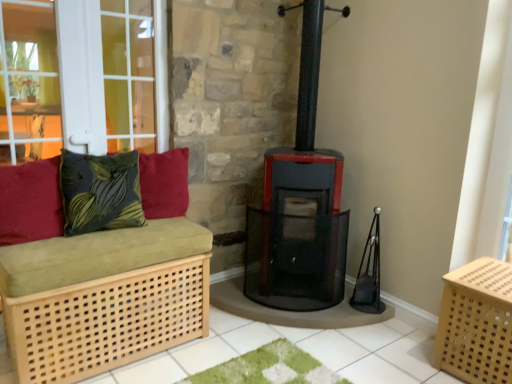
Describe the element at coordinates (100, 192) in the screenshot. I see `green leafy fabric cushion at left, the 2th pillow when ordered from right to left` at that location.

The width and height of the screenshot is (512, 384). Describe the element at coordinates (476, 323) in the screenshot. I see `light wood/canvassed crate at lower right` at that location.

The width and height of the screenshot is (512, 384). I want to click on velvety red cushion at left, placed as the 1th pillow when sorted from left to right, so click(x=30, y=202).

Locate an element on the screen. green leafy fabric cushion at left, positioned as the 2th pillow in left-to-right order is located at coordinates (100, 192).

Is velvety red cushion at left, placed as the 1th pillow when sorted from left to right, far from light wood/canvassed crate at lower right?

velvety red cushion at left, placed as the 1th pillow when sorted from left to right, is far away from light wood/canvassed crate at lower right.

Which is farther, (45, 200) or (458, 281)?

The point (45, 200) is farther from the camera.

From a real-world perspective, is velvety red cushion at left, which is the third pillow in right-to-left order, on light wood/canvassed crate at lower right?

Yes.

Is point (510, 278) positioned behind point (37, 208)?

That is True.

Looking at this image, from the image's perspective, who appears lower, light wood/canvassed crate at lower right or velvety red cushion at left, placed as the 1th pillow when sorted from left to right?

light wood/canvassed crate at lower right.

From a real-world perspective, between light wood/canvassed crate at lower right and velvety red cushion at left, which is the third pillow in right-to-left order, who is vertically lower?

light wood/canvassed crate at lower right is physically lower.

You are a GUI agent. You are given a task and a screenshot of the screen. Output one action in this format:
    pyautogui.click(x=<x>, y=<y>)
    Task: Click on the 1st pillow behind the light wood/canvassed crate at lower right, counting from the anchor's position
    The width and height of the screenshot is (512, 384).
    Given the screenshot: What is the action you would take?
    pyautogui.click(x=30, y=202)

In the scene shown: Considering the sizes of green leafy fabric cushion at left, the 2th pillow when ordered from right to left, and light wood/canvassed crate at lower right in the image, is green leafy fabric cushion at left, the 2th pillow when ordered from right to left, taller or shorter than light wood/canvassed crate at lower right?

Clearly, green leafy fabric cushion at left, the 2th pillow when ordered from right to left, is shorter compared to light wood/canvassed crate at lower right.

From the image's perspective, is green leafy fabric cushion at left, positioned as the 2th pillow in left-to-right order, under light wood/canvassed crate at lower right?

Incorrect, from the image's perspective, green leafy fabric cushion at left, positioned as the 2th pillow in left-to-right order, is higher than light wood/canvassed crate at lower right.

In terms of width, does green leafy fabric cushion at left, the 2th pillow when ordered from right to left, look wider or thinner when compared to light wood/canvassed crate at lower right?

Clearly, green leafy fabric cushion at left, the 2th pillow when ordered from right to left, has less width compared to light wood/canvassed crate at lower right.

Is green leafy fabric cushion at left, positioned as the 2th pillow in left-to-right order, directly adjacent to light wood/canvassed crate at lower right?

No.

Is velvety red cushion at upper left, positioned as the first pillow in right-to-left order, facing away from light wood/canvassed crate at lower right?

No, light wood/canvassed crate at lower right is not at the back of velvety red cushion at upper left, positioned as the first pillow in right-to-left order.

Does velvety red cushion at upper left, which ranks as the third pillow in left-to-right order, have a lesser width compared to light wood/canvassed crate at lower right?

Correct, the width of velvety red cushion at upper left, which ranks as the third pillow in left-to-right order, is less than that of light wood/canvassed crate at lower right.

Is velvety red cushion at upper left, positioned as the first pillow in right-to-left order, far from light wood/canvassed crate at lower right?

Yes.

Considering the sizes of velvety red cushion at upper left, positioned as the first pillow in right-to-left order, and light wood/canvassed crate at lower right in the image, is velvety red cushion at upper left, positioned as the first pillow in right-to-left order, bigger or smaller than light wood/canvassed crate at lower right?

velvety red cushion at upper left, positioned as the first pillow in right-to-left order, is smaller than light wood/canvassed crate at lower right.

Between light wood/canvassed crate at lower right and green leafy fabric cushion at left, the 2th pillow when ordered from right to left, which one has larger width?

light wood/canvassed crate at lower right.

From the image's perspective, is light wood/canvassed crate at lower right above or below green leafy fabric cushion at left, positioned as the 2th pillow in left-to-right order?

Based on their image positions, light wood/canvassed crate at lower right is located beneath green leafy fabric cushion at left, positioned as the 2th pillow in left-to-right order.

Where is `the 3rd pillow directly above the light wood/canvassed crate at lower right (from a real-world perspective)`? The width and height of the screenshot is (512, 384). the 3rd pillow directly above the light wood/canvassed crate at lower right (from a real-world perspective) is located at coordinates (100, 192).

From a real-world perspective, relative to green leafy fabric cushion at left, the 2th pillow when ordered from right to left, is light wood/canvassed crate at lower right vertically above or below?

light wood/canvassed crate at lower right is below green leafy fabric cushion at left, the 2th pillow when ordered from right to left.

Consider the image. How different are the orientations of velvety red cushion at upper left, which ranks as the third pillow in left-to-right order, and velvety red cushion at left, which is the third pillow in right-to-left order, in degrees?

The angle between the facing direction of velvety red cushion at upper left, which ranks as the third pillow in left-to-right order, and the facing direction of velvety red cushion at left, which is the third pillow in right-to-left order, is 4.67 degrees.

From the velvety red cushion at upper left, positioned as the first pillow in right-to-left order, count 2nd pillows forward and point to it. Please provide its 2D coordinates.

[(30, 202)]

From the image's perspective, between velvety red cushion at upper left, positioned as the first pillow in right-to-left order, and velvety red cushion at left, placed as the 1th pillow when sorted from left to right, who is located below?

From the image's view, velvety red cushion at left, placed as the 1th pillow when sorted from left to right, is below.

Is velvety red cushion at left, which is the third pillow in right-to-left order, directly adjacent to light wood/light brown bench at left?

No, velvety red cushion at left, which is the third pillow in right-to-left order, is not next to light wood/light brown bench at left.

Consider the image. Which object is further away from the camera taking this photo, velvety red cushion at left, which is the third pillow in right-to-left order, or light wood/light brown bench at left?

velvety red cushion at left, which is the third pillow in right-to-left order, is further from the camera.

From a real-world perspective, is velvety red cushion at left, placed as the 1th pillow when sorted from left to right, physically located above or below light wood/light brown bench at left?

velvety red cushion at left, placed as the 1th pillow when sorted from left to right, is above light wood/light brown bench at left.

How much distance is there between velvety red cushion at left, which is the third pillow in right-to-left order, and light wood/light brown bench at left?

velvety red cushion at left, which is the third pillow in right-to-left order, and light wood/light brown bench at left are 10.46 inches apart.

Identify the location of crate that is in front of the velvety red cushion at left, which is the third pillow in right-to-left order. The image size is (512, 384). (476, 323).

You are a GUI agent. You are given a task and a screenshot of the screen. Output one action in this format:
    pyautogui.click(x=<x>, y=<y>)
    Task: Click on the crate below the velvety red cushion at left, which is the third pillow in right-to-left order (from the image's perspective)
    
    Given the screenshot: What is the action you would take?
    pyautogui.click(x=476, y=323)

Based on their spatial positions, is green leafy fabric cushion at left, positioned as the 2th pillow in left-to-right order, or velvety red cushion at left, which is the third pillow in right-to-left order, closer to velvety red cushion at upper left, positioned as the first pillow in right-to-left order?

green leafy fabric cushion at left, positioned as the 2th pillow in left-to-right order, is closer to velvety red cushion at upper left, positioned as the first pillow in right-to-left order.

Considering their positions, is light wood/canvassed crate at lower right positioned closer to velvety red cushion at upper left, which ranks as the third pillow in left-to-right order, than velvety red cushion at left, which is the third pillow in right-to-left order?

Among the two, velvety red cushion at left, which is the third pillow in right-to-left order, is located nearer to velvety red cushion at upper left, which ranks as the third pillow in left-to-right order.

Estimate the real-world distances between objects in this image. Which object is further from velvety red cushion at left, which is the third pillow in right-to-left order, light wood/canvassed crate at lower right or light wood/light brown bench at left?

The object further to velvety red cushion at left, which is the third pillow in right-to-left order, is light wood/canvassed crate at lower right.

Estimate the real-world distances between objects in this image. Which object is further from green leafy fabric cushion at left, positioned as the 2th pillow in left-to-right order, light wood/light brown bench at left or light wood/canvassed crate at lower right?

light wood/canvassed crate at lower right.

From the image, which object appears to be farther from light wood/canvassed crate at lower right, green leafy fabric cushion at left, the 2th pillow when ordered from right to left, or velvety red cushion at left, which is the third pillow in right-to-left order?

Based on the image, velvety red cushion at left, which is the third pillow in right-to-left order, appears to be further to light wood/canvassed crate at lower right.

Based on their spatial positions, is velvety red cushion at upper left, positioned as the first pillow in right-to-left order, or light wood/canvassed crate at lower right closer to light wood/light brown bench at left?

The object closer to light wood/light brown bench at left is velvety red cushion at upper left, positioned as the first pillow in right-to-left order.

Estimate the real-world distances between objects in this image. Which object is closer to velvety red cushion at upper left, which ranks as the third pillow in left-to-right order, light wood/canvassed crate at lower right or green leafy fabric cushion at left, positioned as the 2th pillow in left-to-right order?

The object closer to velvety red cushion at upper left, which ranks as the third pillow in left-to-right order, is green leafy fabric cushion at left, positioned as the 2th pillow in left-to-right order.

Based on their spatial positions, is light wood/light brown bench at left or velvety red cushion at left, placed as the 1th pillow when sorted from left to right, closer to velvety red cushion at upper left, positioned as the first pillow in right-to-left order?

light wood/light brown bench at left is positioned closer to the anchor velvety red cushion at upper left, positioned as the first pillow in right-to-left order.

Find the location of `furniture between green leafy fabric cushion at left, positioned as the 2th pillow in left-to-right order, and light wood/canvassed crate at lower right from left to right`. furniture between green leafy fabric cushion at left, positioned as the 2th pillow in left-to-right order, and light wood/canvassed crate at lower right from left to right is located at coordinates (98, 275).

At what (x,y) coordinates should I click in order to perform the action: click on furniture situated between velvety red cushion at left, which is the third pillow in right-to-left order, and light wood/canvassed crate at lower right from left to right. Please return your answer as a coordinate pair (x, y). The width and height of the screenshot is (512, 384). Looking at the image, I should click on (98, 275).

Where is `pillow between green leafy fabric cushion at left, positioned as the 2th pillow in left-to-right order, and light wood/canvassed crate at lower right, in the horizontal direction`? pillow between green leafy fabric cushion at left, positioned as the 2th pillow in left-to-right order, and light wood/canvassed crate at lower right, in the horizontal direction is located at coordinates (164, 183).

You are a GUI agent. You are given a task and a screenshot of the screen. Output one action in this format:
    pyautogui.click(x=<x>, y=<y>)
    Task: Click on the pillow between velvety red cushion at left, placed as the 1th pillow when sorted from left to right, and velvety red cushion at upper left, positioned as the first pillow in right-to-left order
    This screenshot has width=512, height=384.
    Given the screenshot: What is the action you would take?
    pyautogui.click(x=100, y=192)